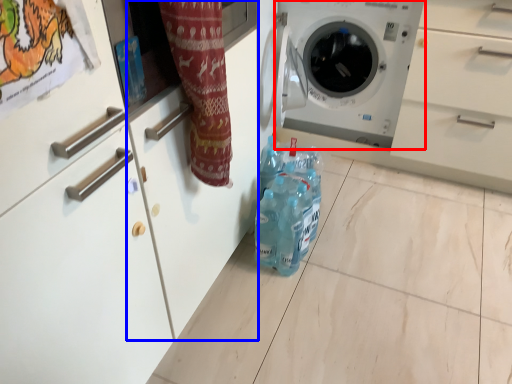
Question: Which point is further to the camera, washing machine (highlighted by a red box) or cabinetry (highlighted by a blue box)?

Choices:
 (A) washing machine
 (B) cabinetry

Answer: (A)